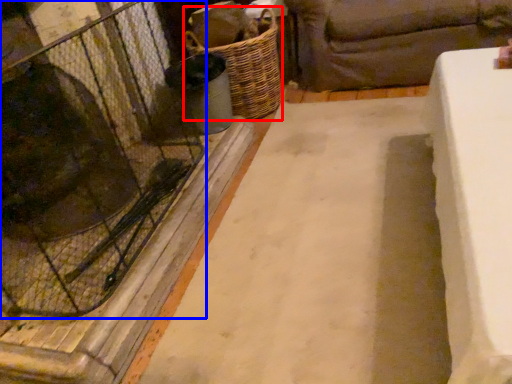
Question: Which object is further to the camera taking this photo, basket (highlighted by a red box) or glass door (highlighted by a blue box)?

Choices:
 (A) basket
 (B) glass door

Answer: (A)